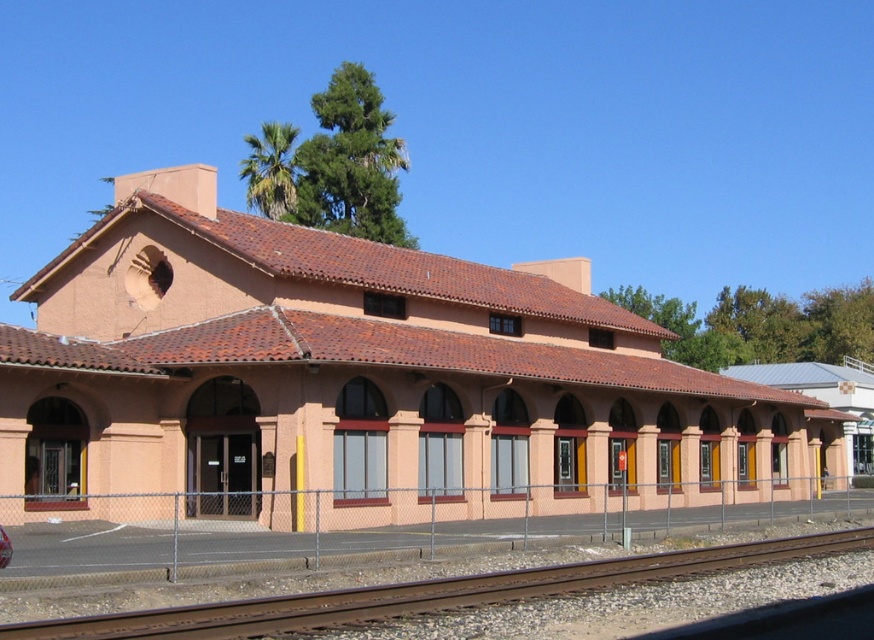
You are a photographer planning to capture the matte pink building at center and the rusty metal train track at lower left in a single shot. Given that the camera frame can only accommodate objects up to the size of the building, will the track fit within the frame?

The matte pink building at center is wider than the rusty metal train track at lower left. Since the camera frame can fit the building, the track will also fit within the frame as it is narrower.

You are standing in front of a historic building and want to take a photo that includes both the matte pink building at center and the chain link fence in front of it. Given that your camera can focus on objects up to 20 meters away, will you be able to capture both in clear focus?

The matte pink building at center is 21.01 meters away from the viewer, which exceeds the camera focus limit of 20 meters. Therefore, the building will be out of focus, while the chain link fence closer to the viewer may be in focus. You won

You are a photographer planning to take a picture of the matte pink building at center and the rusty metal train track at lower left. Which object should you focus on first if you want to capture both in a single frame without moving the camera?

The matte pink building at center is bigger than the rusty metal train track at lower left, so you should focus on the matte pink building at center first to ensure it is sharp and centered in the frame before adjusting for the smaller track.